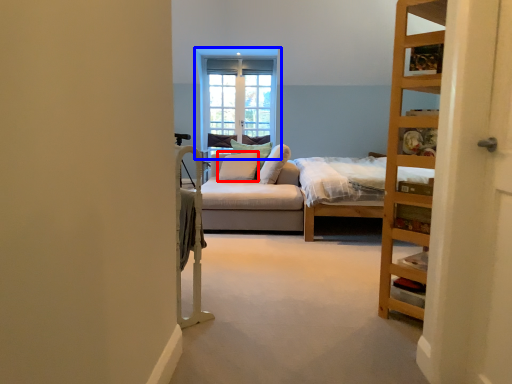
Question: Which object appears farthest to the camera in this image, pillow (highlighted by a red box) or window (highlighted by a blue box)?

Choices:
 (A) pillow
 (B) window

Answer: (B)